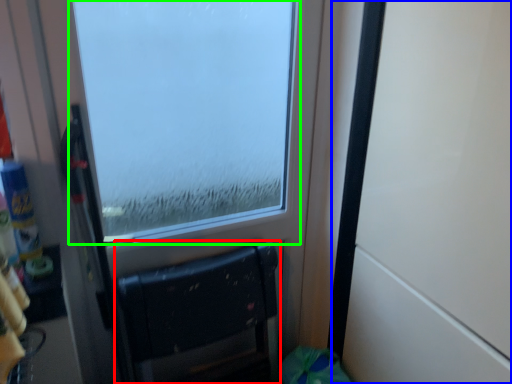
Question: Which object is positioned farthest from furniture (highlighted by a red box)? Select from door (highlighted by a blue box) and window (highlighted by a green box).

Choices:
 (A) door
 (B) window

Answer: (B)